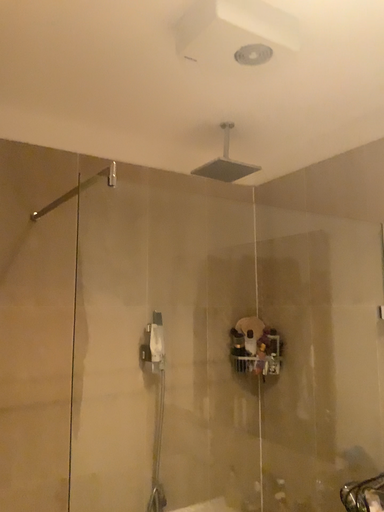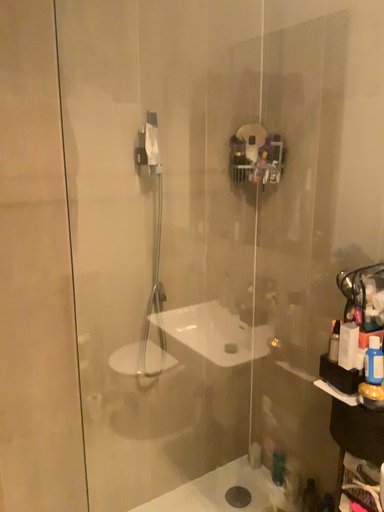
Question: Which way did the camera rotate in the video?

Choices:
 (A) rotated downward
 (B) rotated upward

Answer: (A)